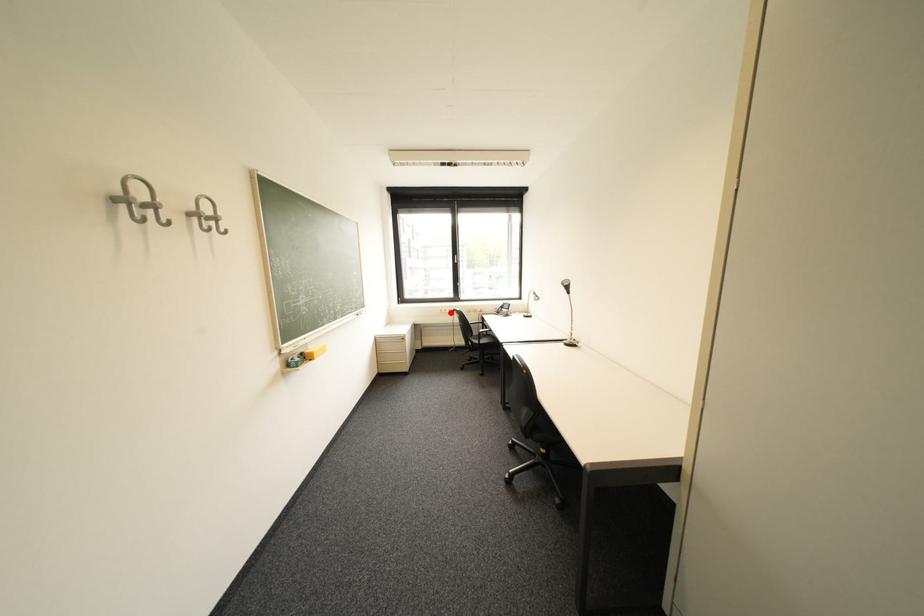
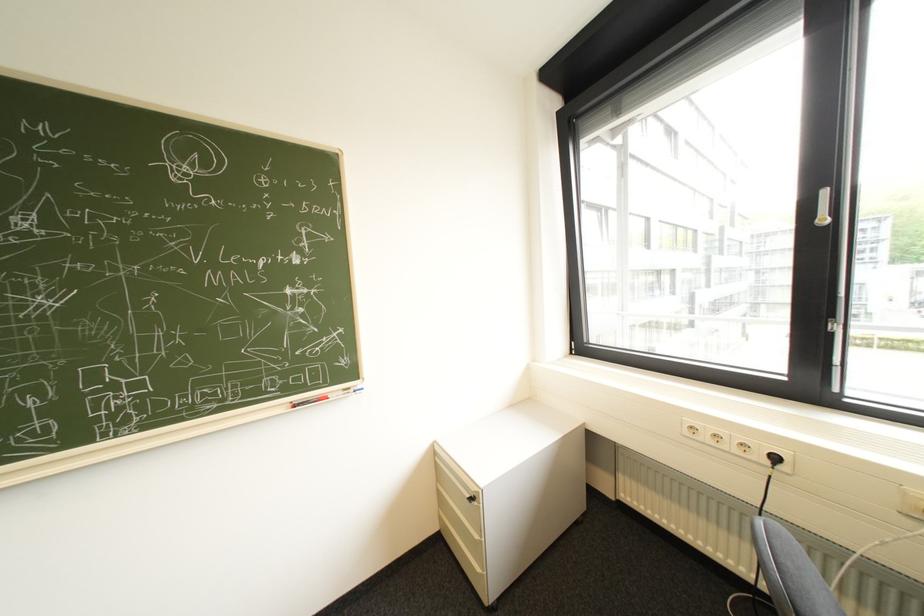
Where in the second image is the point corresponding to the highlighted location from the first image?

(698, 434)